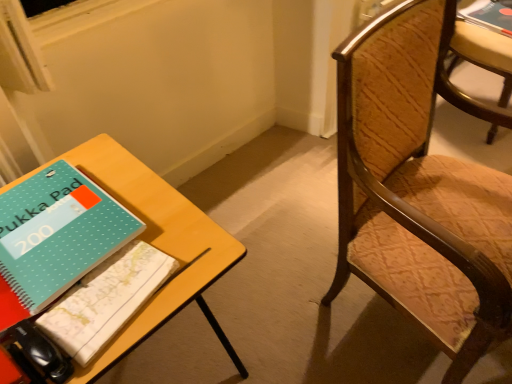
Question: From a real-world perspective, is wooden textured chair at right, which is counted as the second chair, starting from the left, physically located above or below yellow wood table at lower left?

Choices:
 (A) above
 (B) below

Answer: (B)

Question: Considering their positions, is wooden textured chair at right, the first chair in the right-to-left sequence, located in front of or behind yellow wood table at lower left?

Choices:
 (A) front
 (B) behind

Answer: (B)

Question: Estimate the real-world distances between objects in this image. Which object is farther from the teal matte notebook at left, positioned as the 2th book in back-to-front order?

Choices:
 (A) matte black book at upper right, marked as the third book in a left-to-right arrangement
 (B) wooden textured chair at right, acting as the 2th chair starting from the front
 (C) wooden textured chair at right, which ranks as the 1th chair in left-to-right order
 (D) teal dotted notebook at lower left, which is counted as the 3th book, starting from the top
 (E) yellow wood table at lower left

Answer: (A)

Question: Which is farther from the wooden textured chair at right, which ranks as the 1th chair in left-to-right order?

Choices:
 (A) teal matte notebook at left, the 2th book viewed from the top
 (B) matte black book at upper right, arranged as the first book when viewed from the top
 (C) wooden textured chair at right, the first chair when ordered from back to front
 (D) teal dotted notebook at lower left, positioned as the 3th book in back-to-front order
 (E) yellow wood table at lower left

Answer: (B)